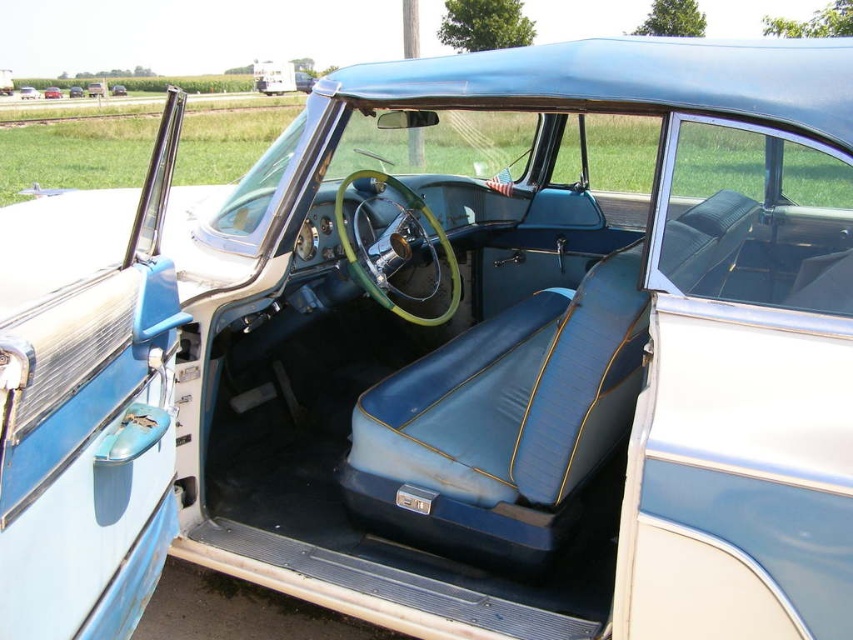
You are sitting in the driver seat of the vintage car and notice two points marked on the dashboard. Which point, point (21, 97) or point (44, 96), is closer to your eyes?

Point (21, 97) is closer to your eyes because it is further to the viewer than point (44, 96).

You are a passenger sitting in the matte blue leather seats at center of the vintage car. You want to reach the glove compartment located in the matte blue leather car at center. Based on their positions, can you easily access the glove compartment from your current position?

The matte blue leather car at center is above the matte blue leather seats at center, so the glove compartment in the matte blue leather car at center is positioned higher than the seats. This means you can easily reach it from the matte blue leather seats at center since it is within arm